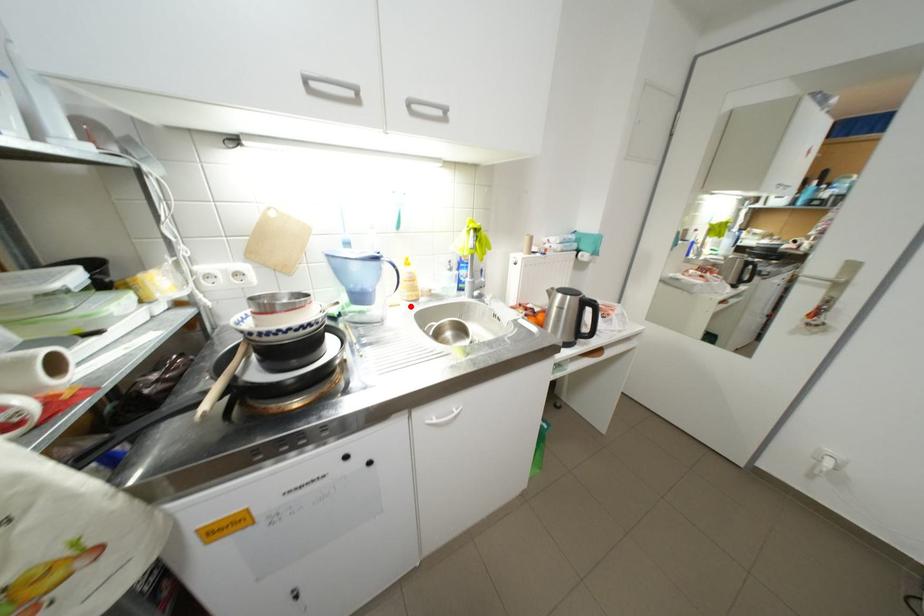
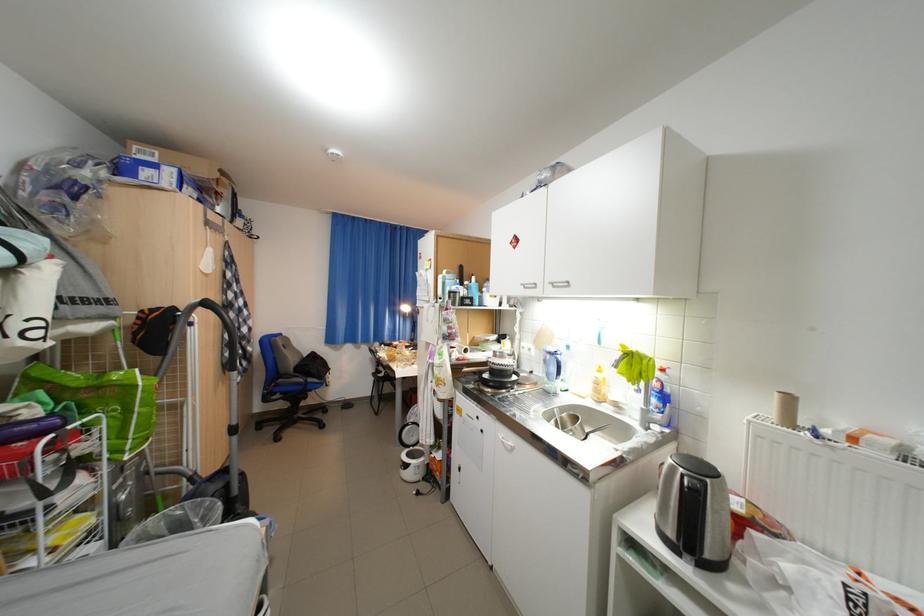
Where in the second image is the point corresponding to the highlighted location from the first image?

(594, 399)